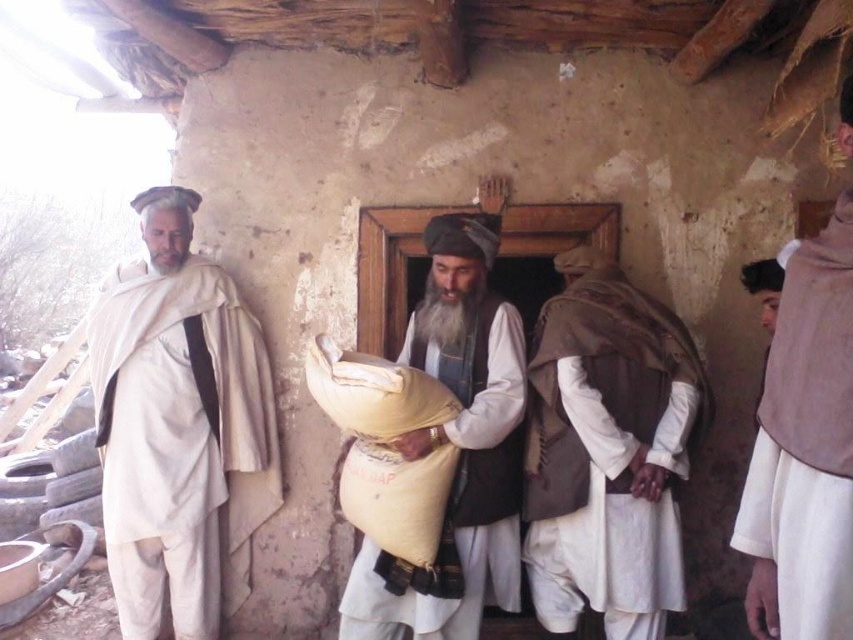
Between yellow fabric sack at center and white cotton robe at right, which one has less height?

white cotton robe at right is shorter.

Does yellow fabric sack at center come in front of white cotton robe at right?

That is False.

At what (x,y) coordinates should I click in order to perform the action: click on yellow fabric sack at center. Please return your answer as a coordinate pair (x, y). Image resolution: width=853 pixels, height=640 pixels. Looking at the image, I should click on (457, 445).

Who is higher up, brown textured vest at right or yellow fabric sack at center?

yellow fabric sack at center is above.

Looking at this image, is brown textured vest at right shorter than yellow fabric sack at center?

Yes.

Is point (683, 342) farther from camera compared to point (453, 577)?

Yes, point (683, 342) is farther from viewer.

I want to click on brown textured vest at right, so [608, 456].

Who is positioned more to the left, brown textured vest at right or white cotton robe at right?

Positioned to the left is brown textured vest at right.

Is brown textured vest at right further to the viewer compared to white cotton robe at right?

Yes, it is behind white cotton robe at right.

The image size is (853, 640). What do you see at coordinates (608, 456) in the screenshot? I see `brown textured vest at right` at bounding box center [608, 456].

The image size is (853, 640). I want to click on brown textured vest at right, so click(608, 456).